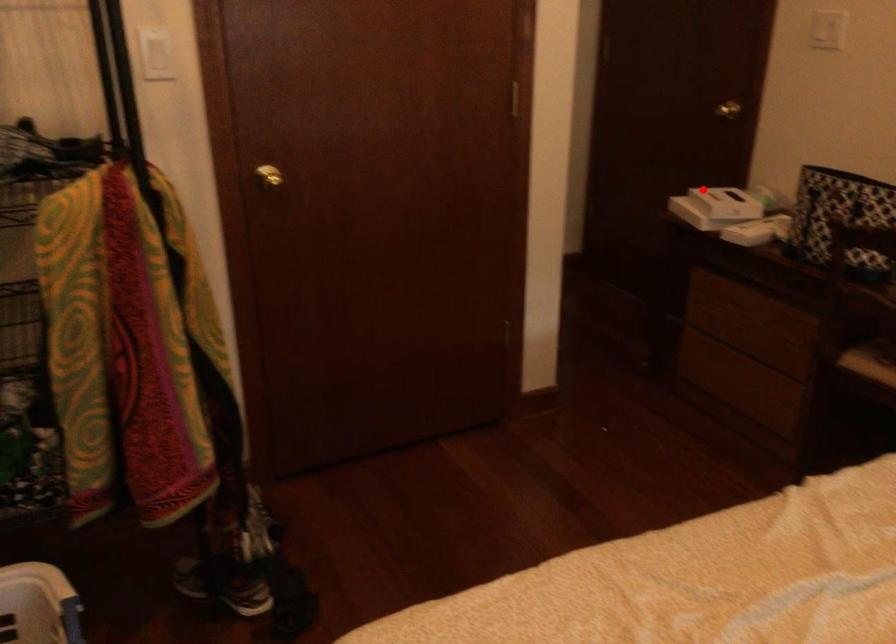
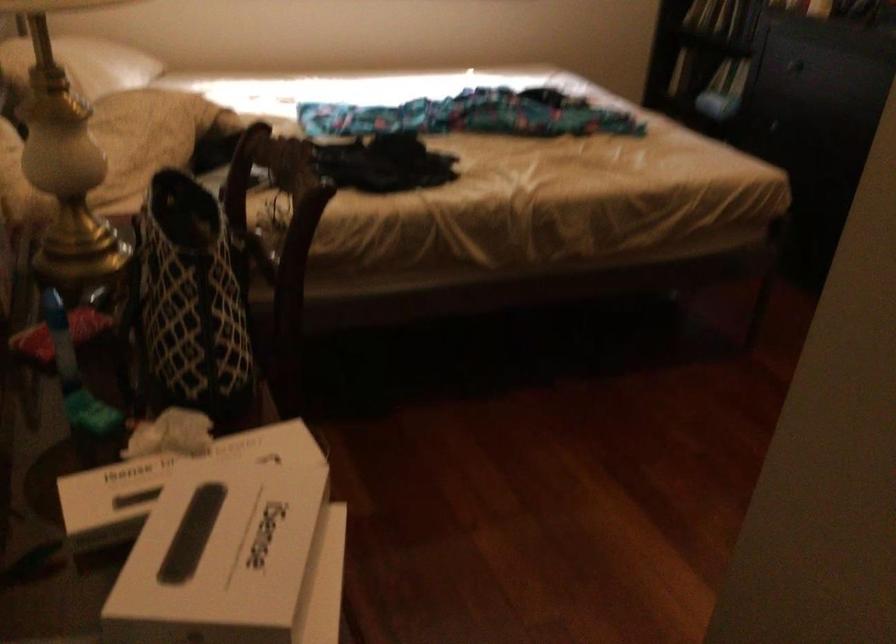
Question: A red point is marked in image1. In image2, is the corresponding 3D point closer to the camera or farther? Reply with the corresponding letter.

Choices:
 (A) The corresponding 3D point is closer.
 (B) The corresponding 3D point is farther.

Answer: (A)